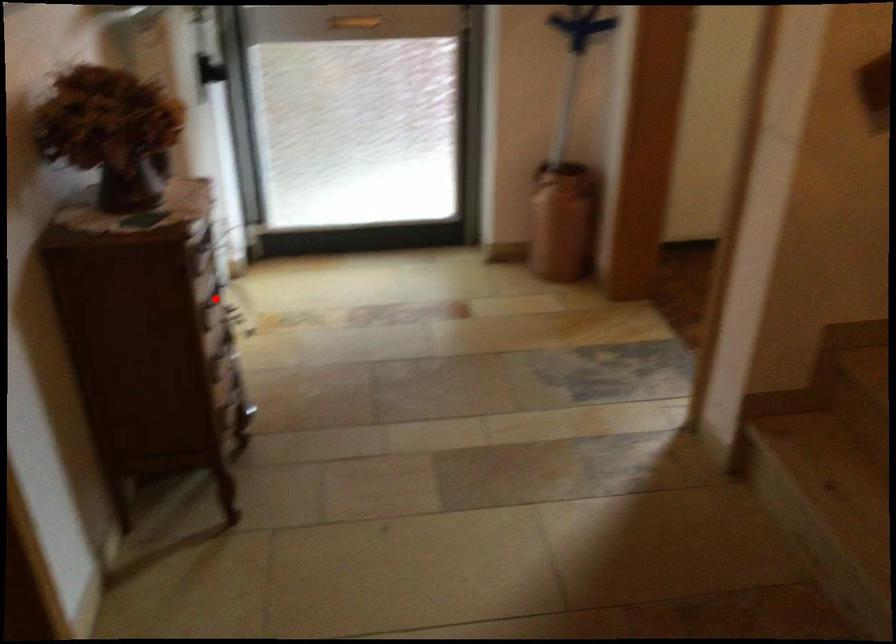
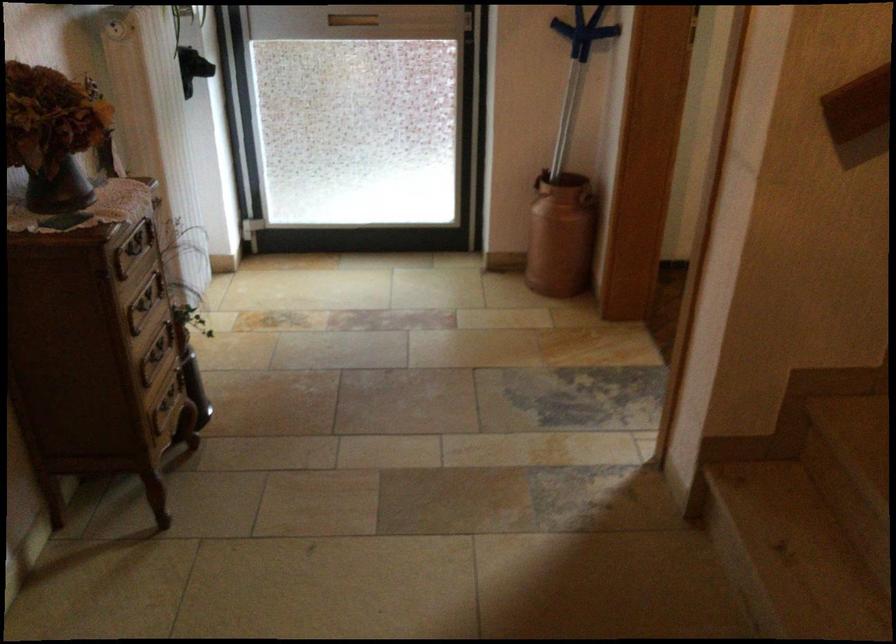
Locate, in the second image, the point that corresponds to the highlighted location in the first image.

(144, 303)